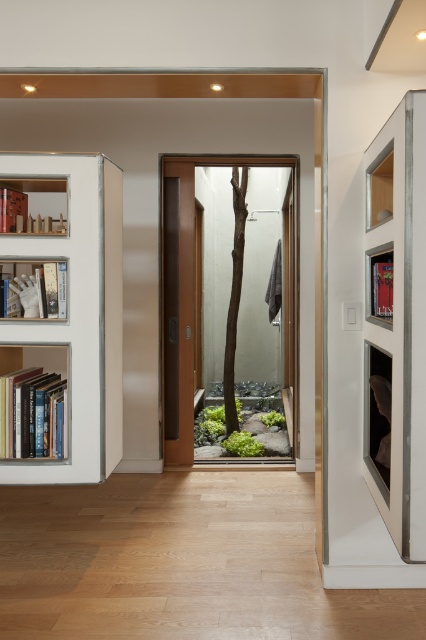
Between point (46, 433) and point (233, 196), which one is positioned behind?

The point (233, 196) is more distant.

Does hardcover books at left have a larger size compared to brown rough textured tree at center?

No.

Describe the element at coordinates (31, 413) in the screenshot. The width and height of the screenshot is (426, 640). I see `hardcover books at left` at that location.

The width and height of the screenshot is (426, 640). In order to click on hardcover books at left in this screenshot , I will do `click(31, 413)`.

Who is taller, transparent glass door at center or matte wood shelf at left?

With more height is transparent glass door at center.

The width and height of the screenshot is (426, 640). What do you see at coordinates (229, 307) in the screenshot?
I see `transparent glass door at center` at bounding box center [229, 307].

Measure the distance between point (256, 376) and camera.

A distance of 24.66 feet exists between point (256, 376) and camera.

You are a GUI agent. You are given a task and a screenshot of the screen. Output one action in this format:
    pyautogui.click(x=<x>, y=<y>)
    Task: Click on the transparent glass door at center
    The image size is (426, 640).
    Given the screenshot: What is the action you would take?
    pyautogui.click(x=229, y=307)

Who is lower down, matte white bookshelf at left or brown rough textured tree at center?

matte white bookshelf at left is lower down.

Does matte white bookshelf at left appear on the left side of brown rough textured tree at center?

Indeed, matte white bookshelf at left is positioned on the left side of brown rough textured tree at center.

What do you see at coordinates (36, 289) in the screenshot? I see `matte white bookshelf at left` at bounding box center [36, 289].

The width and height of the screenshot is (426, 640). Find the location of `matte white bookshelf at left`. matte white bookshelf at left is located at coordinates (36, 289).